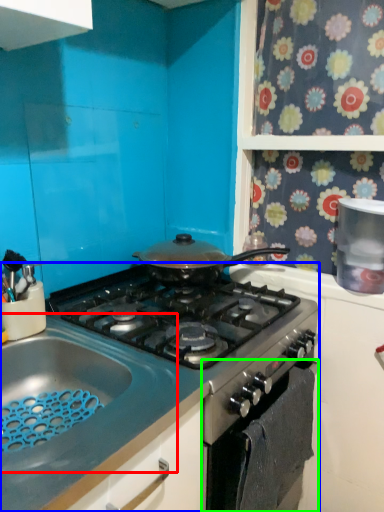
Question: Which is nearer to the sink (highlighted by a red box)? gas stove (highlighted by a blue box) or oven (highlighted by a green box).

Choices:
 (A) gas stove
 (B) oven

Answer: (A)